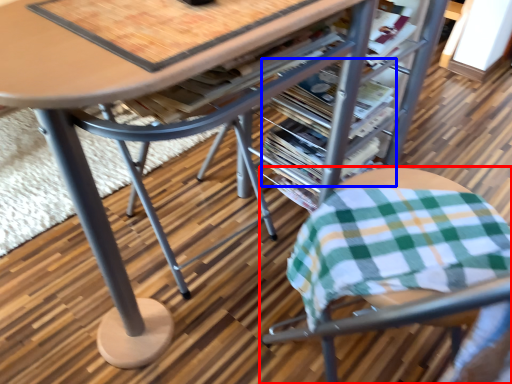
Question: Which point is closer to the camera, chair (highlighted by a red box) or magazine (highlighted by a blue box)?

Choices:
 (A) chair
 (B) magazine

Answer: (A)